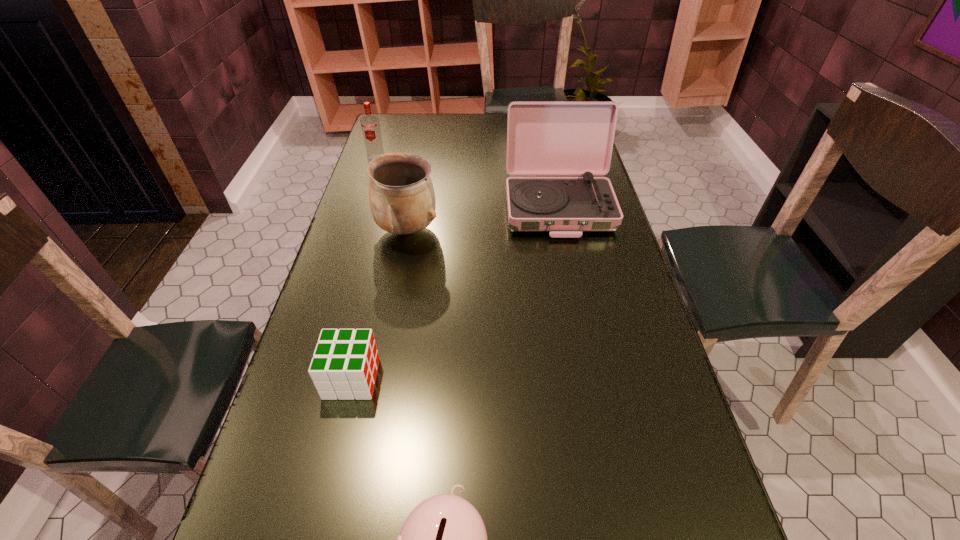
Locate an element on the screen. This screenshot has width=960, height=540. vacant space located 0.230m on the red face of the cube is located at coordinates (483, 378).

At what (x,y) coordinates should I click in order to perform the action: click on urn positioned at the left edge. Please return your answer as a coordinate pair (x, y). The width and height of the screenshot is (960, 540). Looking at the image, I should click on (402, 199).

You are a GUI agent. You are given a task and a screenshot of the screen. Output one action in this format:
    pyautogui.click(x=<x>, y=<y>)
    Task: Click on the vodka located in the left edge section of the desktop
    This screenshot has width=960, height=540.
    Given the screenshot: What is the action you would take?
    pyautogui.click(x=370, y=124)

Locate an element on the screen. This screenshot has width=960, height=540. cube that is at the left edge is located at coordinates (344, 365).

At what (x,y) coordinates should I click in order to perform the action: click on object at the right edge. Please return your answer as a coordinate pair (x, y). Image resolution: width=960 pixels, height=540 pixels. Looking at the image, I should click on 543,138.

Identify the location of free space at the far edge. (503, 125).

The height and width of the screenshot is (540, 960). I want to click on vacant space at the left edge of the desktop, so click(364, 254).

Image resolution: width=960 pixels, height=540 pixels. Find the location of `vacant space at the right edge of the desktop`. vacant space at the right edge of the desktop is located at coordinates 667,491.

This screenshot has width=960, height=540. Identify the location of vacant area between the shortest object and the vodka. (364, 268).

Where is `free space between the cube and the tallest object`? free space between the cube and the tallest object is located at coordinates (455, 293).